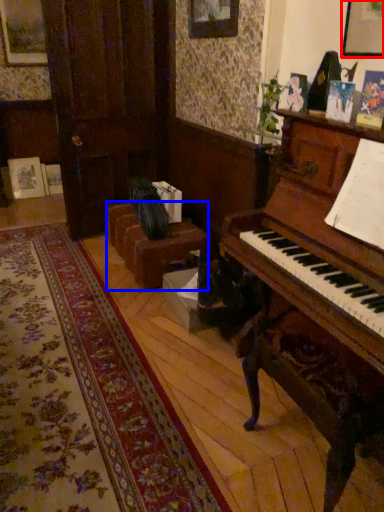
Question: Which object is closer to the camera taking this photo, picture frame (highlighted by a red box) or furniture (highlighted by a blue box)?

Choices:
 (A) picture frame
 (B) furniture

Answer: (A)